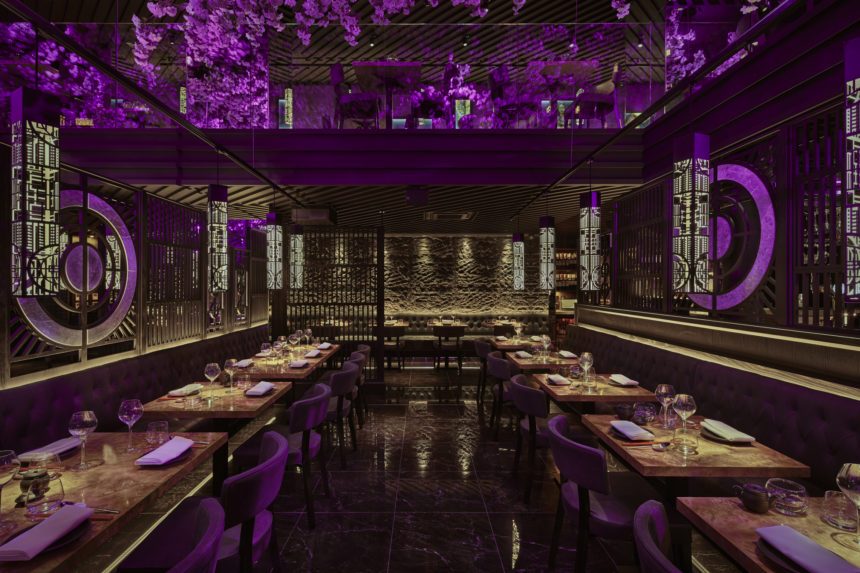
What are the coordinates of `rightmost table` in the screenshot? It's located at coord(733,531).